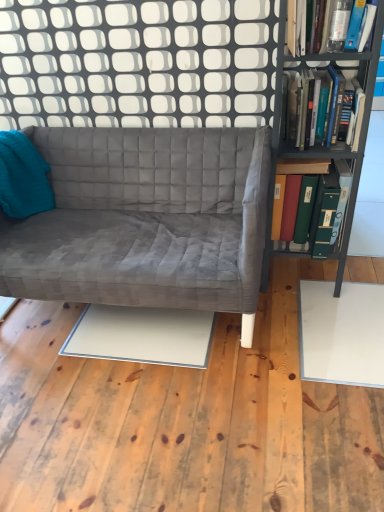
Question: Is transparent glass door at upper center taller or shorter than teal fabric throw pillow at left?

Choices:
 (A) short
 (B) tall

Answer: (B)

Question: Is point 69,118 closer or farther from the camera than point 13,184?

Choices:
 (A) farther
 (B) closer

Answer: (A)

Question: Based on their relative distances, which object is nearer to the green matte folder at right, marked as the first book in a bottom-to-top arrangement?

Choices:
 (A) transparent glass door at upper center
 (B) hardcover books at right, which ranks as the second book in top-to-bottom order
 (C) matte plastic book at upper right, arranged as the 1th book when viewed from the top
 (D) white glossy plywood at lower center
 (E) teal fabric throw pillow at left

Answer: (B)

Question: Which of these objects is positioned farthest from the metallic gray bookcase at right?

Choices:
 (A) transparent glass door at upper center
 (B) matte plastic book at upper right, placed as the third book when sorted from bottom to top
 (C) teal fabric throw pillow at left
 (D) velvet gray couch at center
 (E) white glossy plywood at lower center

Answer: (C)